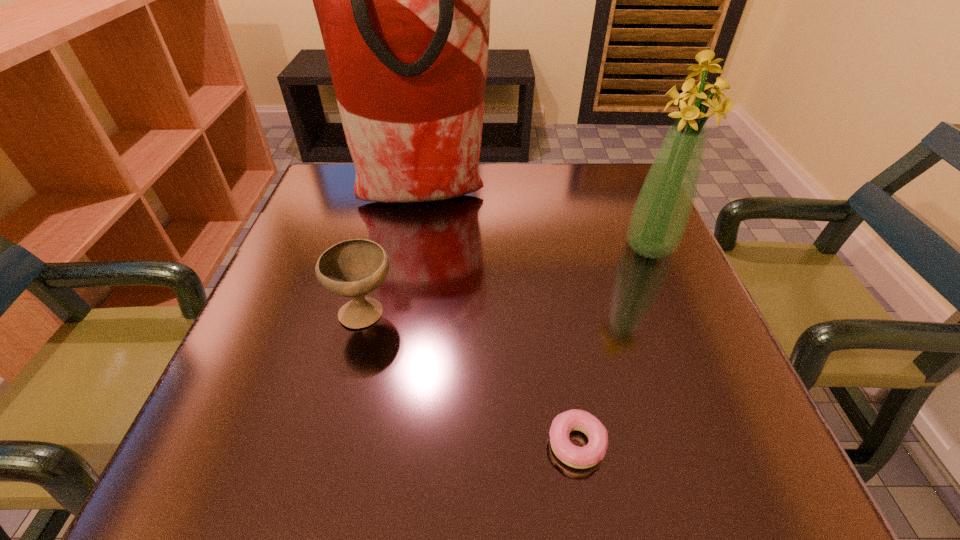
Identify the location of free region located on the back of the third tallest object. Image resolution: width=960 pixels, height=540 pixels. (380, 251).

Where is `vacant space located 0.210m on the left of the nearest object`? This screenshot has width=960, height=540. vacant space located 0.210m on the left of the nearest object is located at coordinates (399, 444).

This screenshot has width=960, height=540. What are the coordinates of `object that is at the far edge` in the screenshot? It's located at (403, 0).

What are the coordinates of `object that is positioned at the near edge` in the screenshot? It's located at (574, 456).

Where is `grocery bag that is at the left edge`? grocery bag that is at the left edge is located at coordinates (403, 0).

Where is `chalice located in the left edge section of the desktop`? The width and height of the screenshot is (960, 540). chalice located in the left edge section of the desktop is located at coordinates (353, 268).

Where is `object that is positioned at the right edge`? The height and width of the screenshot is (540, 960). object that is positioned at the right edge is located at coordinates (659, 218).

You are a GUI agent. You are given a task and a screenshot of the screen. Output one action in this format:
    pyautogui.click(x=<x>, y=<y>)
    Task: Click on the object located at the far left corner
    
    Given the screenshot: What is the action you would take?
    pyautogui.click(x=403, y=0)

You are a GUI agent. You are given a task and a screenshot of the screen. Output one action in this format:
    pyautogui.click(x=<x>, y=<y>)
    Task: Click on the free region at the far edge
    The image size is (960, 540).
    Given the screenshot: What is the action you would take?
    pyautogui.click(x=522, y=197)

This screenshot has width=960, height=540. In the image, there is a desktop. In order to click on vacant space at the near edge in this screenshot , I will do `click(410, 431)`.